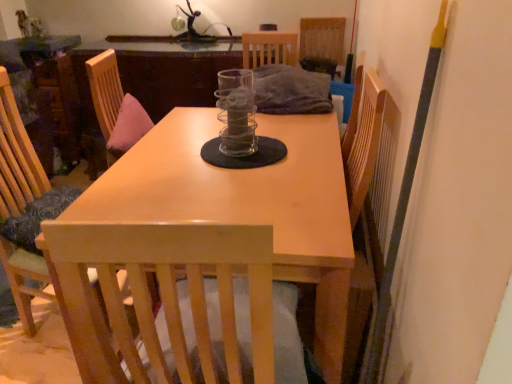
Question: Are metallic glass sculpture at upper center and wooden chair at left, the 2th chair when ordered from top to bottom, making contact?

Choices:
 (A) yes
 (B) no

Answer: (B)

Question: Is metallic glass sculpture at upper center wider than wooden chair at left, marked as the first chair in a left-to-right arrangement?

Choices:
 (A) yes
 (B) no

Answer: (B)

Question: From a real-world perspective, does metallic glass sculpture at upper center sit lower than wooden chair at left, which is the first chair from bottom to top?

Choices:
 (A) no
 (B) yes

Answer: (A)

Question: Is metallic glass sculpture at upper center oriented away from wooden chair at left, the 2th chair when ordered from top to bottom?

Choices:
 (A) yes
 (B) no

Answer: (B)

Question: From the image's perspective, is metallic glass sculpture at upper center above wooden chair at left, placed as the 2th chair when sorted from back to front?

Choices:
 (A) yes
 (B) no

Answer: (A)

Question: From a real-world perspective, is metallic glass sculpture at upper center located higher than wooden chair at left, the 2th chair when ordered from top to bottom?

Choices:
 (A) yes
 (B) no

Answer: (A)

Question: Is wooden chair at left, placed as the 2th chair when sorted from back to front, thinner than light wood table at center?

Choices:
 (A) yes
 (B) no

Answer: (A)

Question: Is wooden chair at left, marked as the second chair in a right-to-left arrangement, in front of light wood table at center?

Choices:
 (A) no
 (B) yes

Answer: (A)

Question: Considering the relative positions of wooden chair at left, marked as the first chair in a left-to-right arrangement, and light wood table at center in the image provided, is wooden chair at left, marked as the first chair in a left-to-right arrangement, to the right of light wood table at center from the viewer's perspective?

Choices:
 (A) yes
 (B) no

Answer: (B)

Question: Is wooden chair at left, the 2th chair when ordered from top to bottom, further to the viewer compared to light wood table at center?

Choices:
 (A) yes
 (B) no

Answer: (A)

Question: From the image's perspective, would you say wooden chair at left, arranged as the first chair when viewed from the front, is positioned over light wood table at center?

Choices:
 (A) no
 (B) yes

Answer: (B)

Question: Is wooden chair at left, marked as the second chair in a right-to-left arrangement, facing towards light wood table at center?

Choices:
 (A) yes
 (B) no

Answer: (A)

Question: Is clear glass jar at center smaller than wooden chair at left, marked as the second chair in a right-to-left arrangement?

Choices:
 (A) no
 (B) yes

Answer: (B)